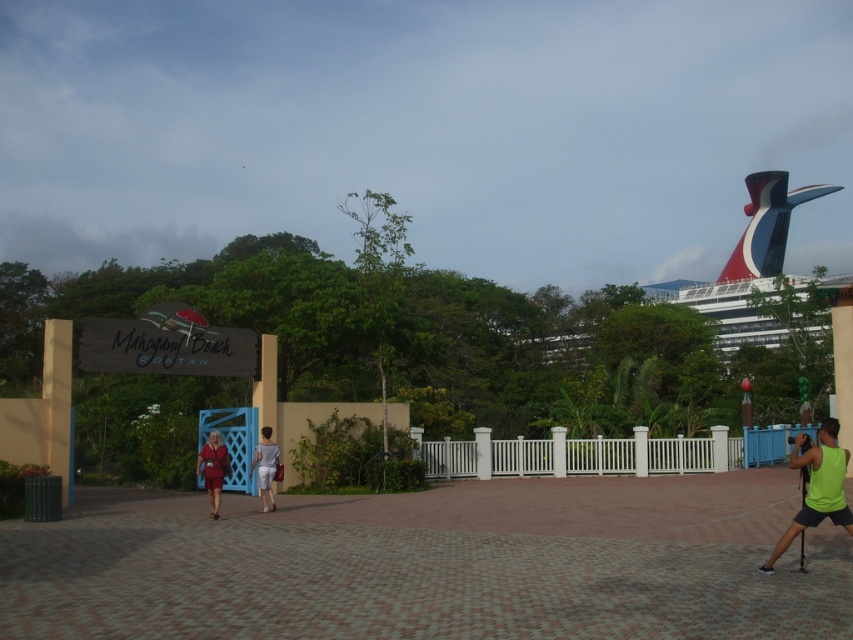
Can you confirm if polished steel cruise ship at upper right is positioned to the right of neon green tank top at lower right?

Correct, you'll find polished steel cruise ship at upper right to the right of neon green tank top at lower right.

Is polished steel cruise ship at upper right to the left of neon green tank top at lower right from the viewer's perspective?

Incorrect, polished steel cruise ship at upper right is not on the left side of neon green tank top at lower right.

Who is more forward, (x=737, y=346) or (x=827, y=442)?

Point (x=827, y=442) is in front.

This screenshot has width=853, height=640. I want to click on polished steel cruise ship at upper right, so click(750, 268).

Is polished steel cruise ship at upper right closer to camera compared to light gray fabric dress at center?

No, polished steel cruise ship at upper right is further to the viewer.

Who is lower down, polished steel cruise ship at upper right or light gray fabric dress at center?

light gray fabric dress at center

I want to click on polished steel cruise ship at upper right, so click(x=750, y=268).

Can you confirm if neon green tank top at lower right is positioned above matte red dress at center?

Correct, neon green tank top at lower right is located above matte red dress at center.

Which is more to the right, neon green tank top at lower right or matte red dress at center?

From the viewer's perspective, neon green tank top at lower right appears more on the right side.

Is point (848, 451) positioned in front of point (209, 454)?

That is True.

The image size is (853, 640). What are the coordinates of `neon green tank top at lower right` in the screenshot? It's located at (817, 486).